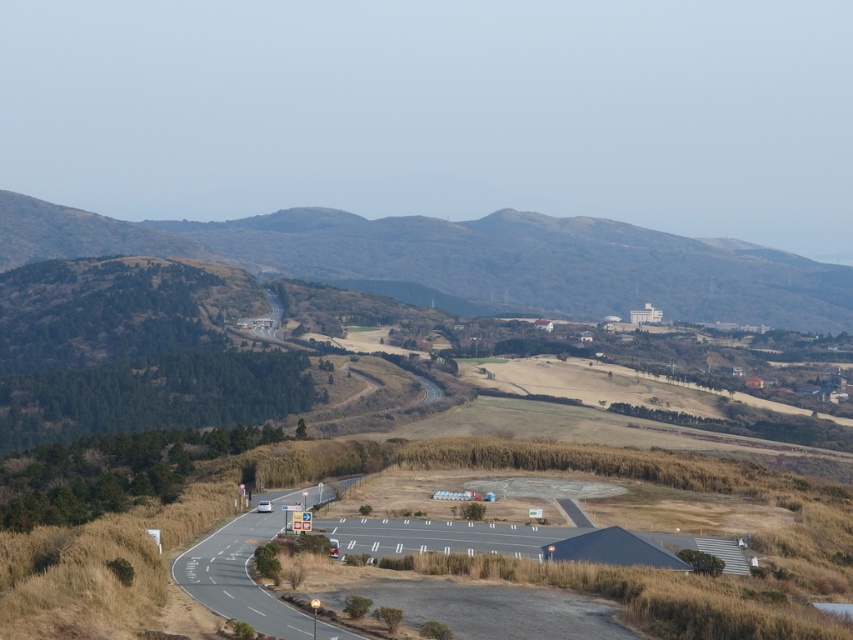
You are driving along the white asphalt highway at lower left and want to turn onto the asphalt road at lower center. Which direction should you turn?

You should turn to the right to go from the white asphalt highway at lower left onto the asphalt road at lower center since the asphalt road at lower center is positioned on the right side of white asphalt highway at lower left.

You are a hiker planning to descend from the brown textured hillside at upper center to the white asphalt highway at lower left. Considering the height difference between them, which direction should you head to reach the highway safely?

The brown textured hillside at upper center is higher than the white asphalt highway at lower left, so you should head downward towards the white asphalt highway at lower left to descend safely.